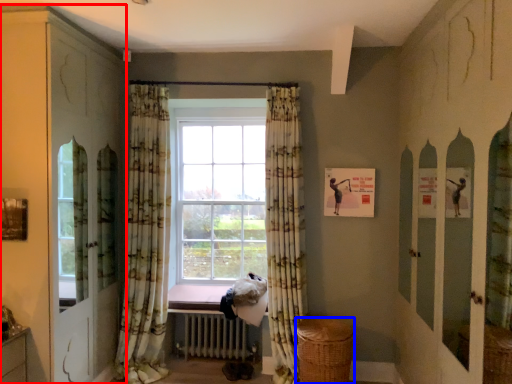
Question: Which point is closer to the camera, dresser (highlighted by a red box) or basket (highlighted by a blue box)?

Choices:
 (A) dresser
 (B) basket

Answer: (A)